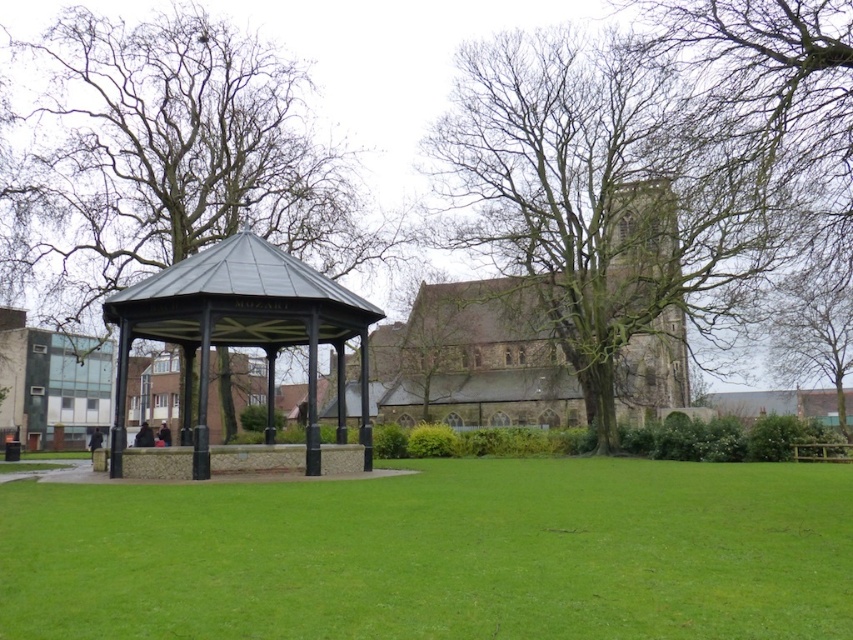
You are an artist setting up an easel to paint the park scene. You want to capture both the green mossy tree at upper right and the green leafy tree at upper right in your painting. Which tree should you focus on first to ensure it appears in the foreground of your painting?

The green mossy tree at upper right is positioned over the green leafy tree at upper right, so focusing on the green mossy tree at upper right first will place it in the foreground of your painting.

You are standing in the park looking at the gazebo and the large stone building. There are two points marked in the image. Which point is closer to you, point (181, 291) or point (781, 358)?

Point (181, 291) is closer to the viewer than point (781, 358).

You are a park visitor trying to decide which tree to sit under for shade. Both the green mossy tree at upper right and the green leafy tree at upper right are options. Which tree would provide more shade coverage based on their sizes?

The green leafy tree at upper right provides more shade coverage because it has a greater width than the green mossy tree at upper right.